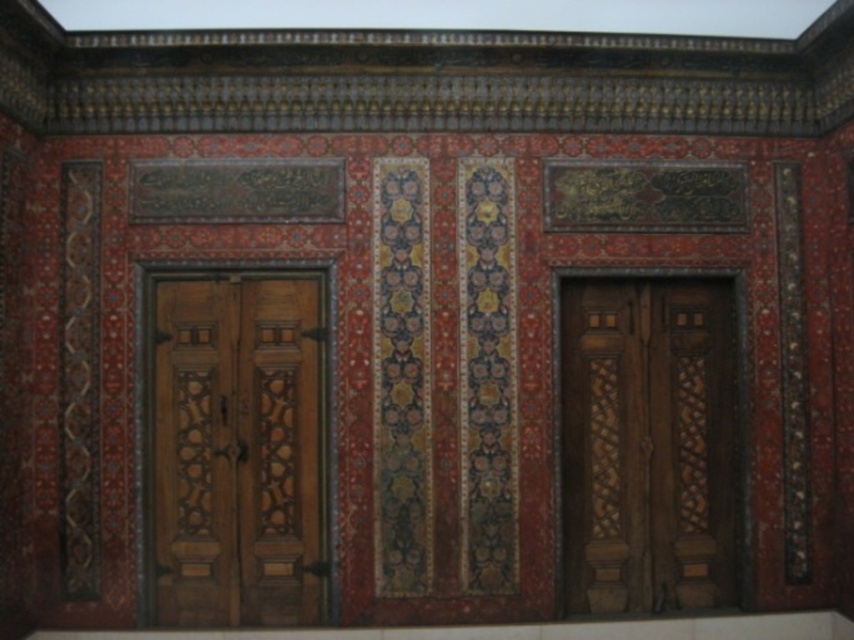
Question: Does polished wood door at left appear on the left side of wooden carved door at center?

Choices:
 (A) yes
 (B) no

Answer: (A)

Question: Is polished wood door at left closer to camera compared to wooden carved door at center?

Choices:
 (A) yes
 (B) no

Answer: (A)

Question: Does polished wood door at left have a greater width compared to wooden carved door at center?

Choices:
 (A) no
 (B) yes

Answer: (A)

Question: Which object appears farthest from the camera in this image?

Choices:
 (A) polished wood door at left
 (B) wooden carved door at center

Answer: (B)

Question: Which point is farther to the camera?

Choices:
 (A) (264, 304)
 (B) (616, 458)

Answer: (B)

Question: Among these objects, which one is farthest from the camera?

Choices:
 (A) polished wood door at left
 (B) wooden carved door at center

Answer: (B)